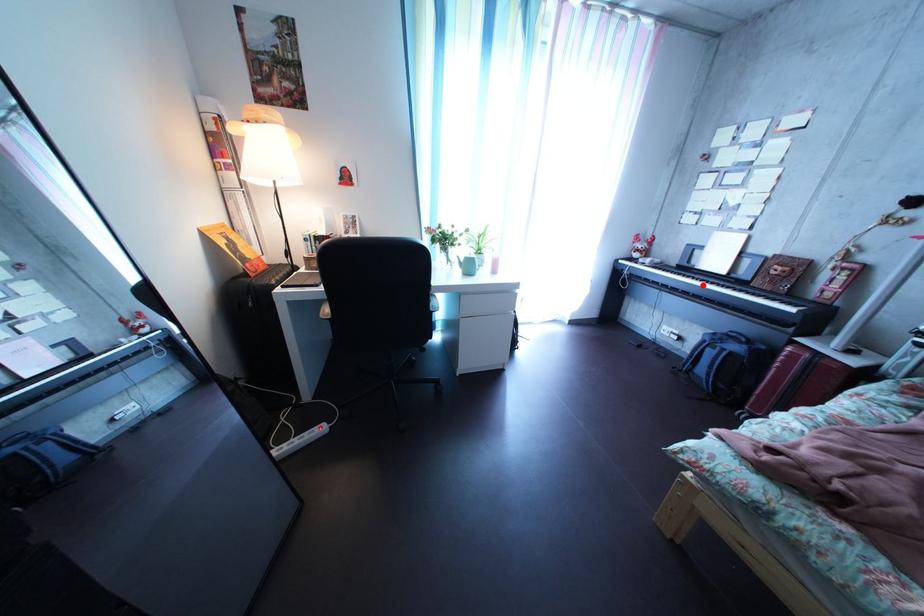
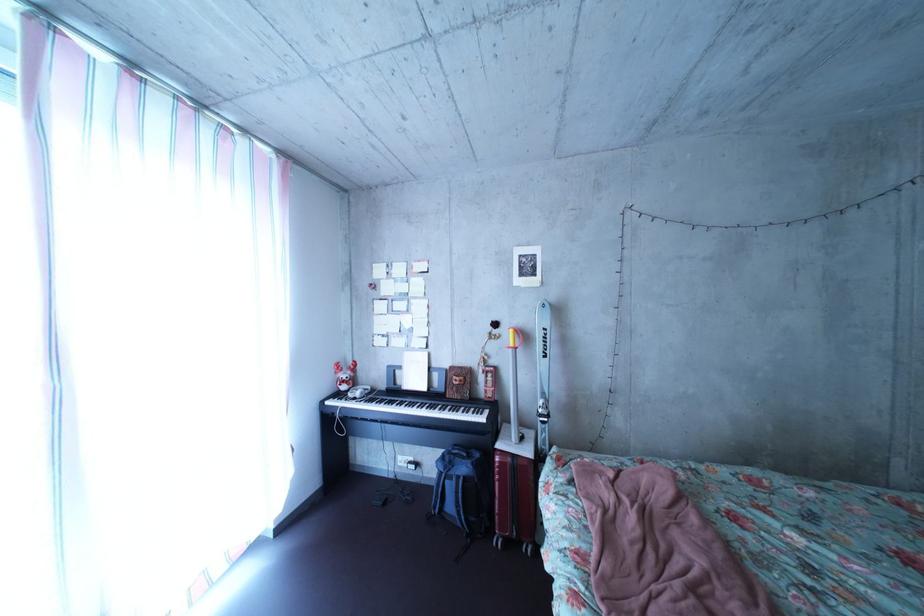
Locate, in the second image, the point that corresponds to the highlighted location in the first image.

(416, 411)